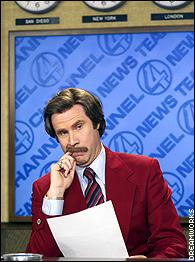
You are a GUI agent. You are given a task and a screenshot of the screen. Output one action in this format:
    pyautogui.click(x=<x>, y=<y>)
    Task: Click on the middle clock
    The image size is (195, 262).
    Given the screenshot: What is the action you would take?
    pyautogui.click(x=105, y=4)